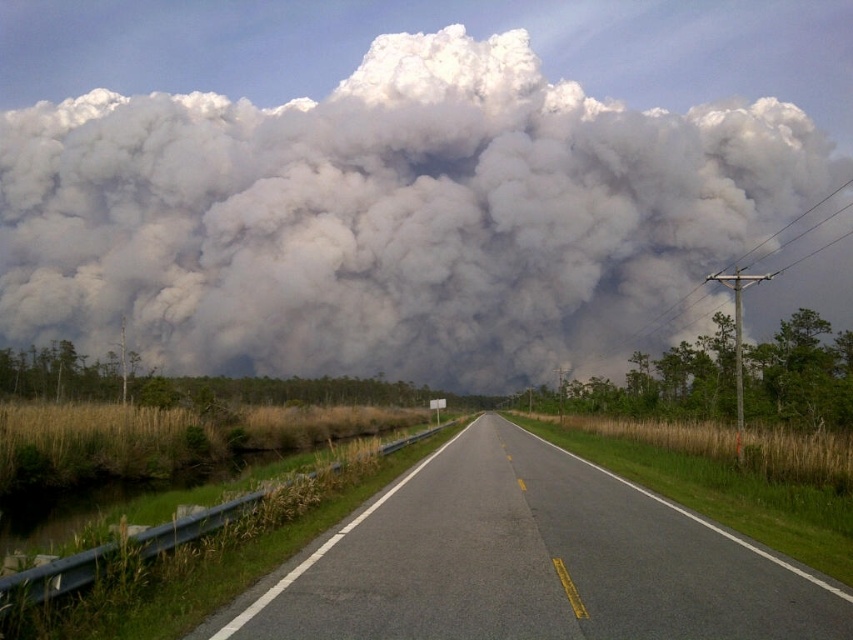
Question: Which point is farther to the camera?

Choices:
 (A) (802, 180)
 (B) (809, 618)

Answer: (A)

Question: Which object appears closest to the camera in this image?

Choices:
 (A) asphalt road at center
 (B) white fluffy cloud at upper center

Answer: (A)

Question: Which object is farther from the camera taking this photo?

Choices:
 (A) asphalt road at center
 (B) white fluffy cloud at upper center

Answer: (B)

Question: Is the position of white fluffy cloud at upper center less distant than that of asphalt road at center?

Choices:
 (A) no
 (B) yes

Answer: (A)

Question: Is white fluffy cloud at upper center thinner than asphalt road at center?

Choices:
 (A) yes
 (B) no

Answer: (B)

Question: Is white fluffy cloud at upper center closer to camera compared to asphalt road at center?

Choices:
 (A) no
 (B) yes

Answer: (A)